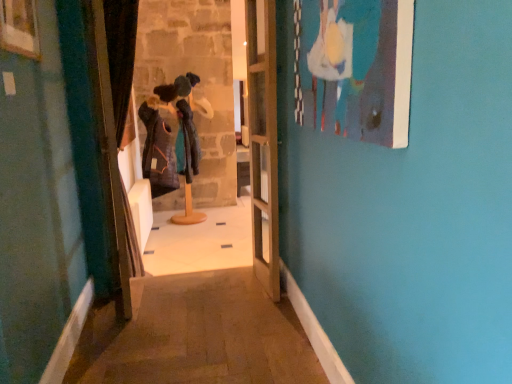
This screenshot has width=512, height=384. What do you see at coordinates (19, 28) in the screenshot?
I see `wooden picture frame at upper left, acting as the 1th picture frame starting from the left` at bounding box center [19, 28].

Identify the location of knitted woolen hat at center. (169, 136).

What is the approximate width of velvet dark brown curtain at left?

It is 3.88 inches.

I want to click on clear glass door at center, so click(263, 141).

From the image's perspective, which picture frame is the 1st one above the clear glass door at center? Please provide its 2D coordinates.

[(354, 68)]

Which point is more forward, (373,120) or (266,254)?

Positioned in front is point (373,120).

From a real-world perspective, who is located lower, matte blue painting at upper right, which appears as the second picture frame when viewed from the left, or clear glass door at center?

From a 3D spatial view, clear glass door at center is below.

Is matte blue painting at upper right, the 1th picture frame viewed from the right, far from clear glass door at center?

matte blue painting at upper right, the 1th picture frame viewed from the right, is far away from clear glass door at center.

In the scene shown: Is velvet dark brown curtain at left aimed at knitted woolen hat at center?

No, velvet dark brown curtain at left is not turned towards knitted woolen hat at center.

Considering the sizes of velvet dark brown curtain at left and knitted woolen hat at center in the image, is velvet dark brown curtain at left wider or thinner than knitted woolen hat at center?

velvet dark brown curtain at left is thinner than knitted woolen hat at center.

Which object is closer to the camera, velvet dark brown curtain at left or knitted woolen hat at center?

velvet dark brown curtain at left.

Which is in front, velvet dark brown curtain at left or clear glass door at center?

velvet dark brown curtain at left is more forward.

From a real-world perspective, is velvet dark brown curtain at left physically located above or below clear glass door at center?

In terms of real-world spatial position, velvet dark brown curtain at left is below clear glass door at center.

Between velvet dark brown curtain at left and clear glass door at center, which one has less height?

velvet dark brown curtain at left is shorter.

Is clear glass door at center surrounded by velvet dark brown curtain at left?

No, velvet dark brown curtain at left does not contain clear glass door at center.

From the image's perspective, between clear glass door at center and velvet dark brown curtain at left, who is located below?

velvet dark brown curtain at left is shown below in the image.

You are a GUI agent. You are given a task and a screenshot of the screen. Output one action in this format:
    pyautogui.click(x=<x>, y=<y>)
    Task: Click on the curtain located below the clear glass door at center (from the image's perspective)
    
    Given the screenshot: What is the action you would take?
    pyautogui.click(x=121, y=56)

Is velvet dark brown curtain at left a part of clear glass door at center?

No, velvet dark brown curtain at left is not surrounded by clear glass door at center.

From a real-world perspective, relative to velvet dark brown curtain at left, is clear glass door at center vertically above or below?

In terms of real-world spatial position, clear glass door at center is above velvet dark brown curtain at left.

Between point (0, 16) and point (116, 73), which one is positioned behind?

Point (116, 73)

This screenshot has width=512, height=384. I want to click on the 1st picture frame in front of the velvet dark brown curtain at left, counting from the anchor's position, so click(x=19, y=28).

Considering the relative sizes of wooden picture frame at upper left, acting as the 1th picture frame starting from the left, and velvet dark brown curtain at left in the image provided, is wooden picture frame at upper left, acting as the 1th picture frame starting from the left, smaller than velvet dark brown curtain at left?

Yes, wooden picture frame at upper left, acting as the 1th picture frame starting from the left, is smaller than velvet dark brown curtain at left.

Where is `curtain in front of the knitted woolen hat at center`? The image size is (512, 384). curtain in front of the knitted woolen hat at center is located at coordinates (121, 56).

Consider the image. Which is correct: knitted woolen hat at center is inside velvet dark brown curtain at left, or outside of it?

knitted woolen hat at center is not enclosed by velvet dark brown curtain at left.

Is knitted woolen hat at center bigger than velvet dark brown curtain at left?

Indeed, knitted woolen hat at center has a larger size compared to velvet dark brown curtain at left.

Is knitted woolen hat at center positioned beyond the bounds of wooden picture frame at upper left, acting as the 1th picture frame starting from the left?

Yes, knitted woolen hat at center is outside of wooden picture frame at upper left, acting as the 1th picture frame starting from the left.

Is point (169, 93) closer or farther from the camera than point (37, 40)?

Point (169, 93).

Where is `couple that appears on the right of wooden picture frame at upper left, which is the 2th picture frame in right-to-left order`? couple that appears on the right of wooden picture frame at upper left, which is the 2th picture frame in right-to-left order is located at coordinates (169, 136).

Is knitted woolen hat at center at the right side of wooden picture frame at upper left, acting as the 1th picture frame starting from the left?

Indeed, knitted woolen hat at center is positioned on the right side of wooden picture frame at upper left, acting as the 1th picture frame starting from the left.

Identify the location of door below the matte blue painting at upper right, the 1th picture frame viewed from the right (from the image's perspective). The width and height of the screenshot is (512, 384). (263, 141).

I want to click on couple that is above the velvet dark brown curtain at left (from the image's perspective), so click(169, 136).

Estimate the real-world distances between objects in this image. Which object is closer to matte blue painting at upper right, the 1th picture frame viewed from the right, velvet dark brown curtain at left or clear glass door at center?

Based on the image, clear glass door at center appears to be nearer to matte blue painting at upper right, the 1th picture frame viewed from the right.

When comparing their distances from velvet dark brown curtain at left, does matte blue painting at upper right, which appears as the second picture frame when viewed from the left, or knitted woolen hat at center seem closer?

matte blue painting at upper right, which appears as the second picture frame when viewed from the left, is closer to velvet dark brown curtain at left.

Based on their spatial positions, is clear glass door at center or matte blue painting at upper right, the 1th picture frame viewed from the right, further from knitted woolen hat at center?

matte blue painting at upper right, the 1th picture frame viewed from the right.

From the image, which object appears to be nearer to velvet dark brown curtain at left, wooden picture frame at upper left, acting as the 1th picture frame starting from the left, or matte blue painting at upper right, which appears as the second picture frame when viewed from the left?

The object closer to velvet dark brown curtain at left is wooden picture frame at upper left, acting as the 1th picture frame starting from the left.

Based on the photo, looking at the image, which one is located further to clear glass door at center, matte blue painting at upper right, which appears as the second picture frame when viewed from the left, or wooden picture frame at upper left, which is the 2th picture frame in right-to-left order?

The object further to clear glass door at center is wooden picture frame at upper left, which is the 2th picture frame in right-to-left order.

Looking at the image, which one is located closer to matte blue painting at upper right, which appears as the second picture frame when viewed from the left, clear glass door at center or wooden picture frame at upper left, which is the 2th picture frame in right-to-left order?

The object closer to matte blue painting at upper right, which appears as the second picture frame when viewed from the left, is clear glass door at center.

Looking at the image, which one is located closer to matte blue painting at upper right, which appears as the second picture frame when viewed from the left, wooden picture frame at upper left, acting as the 1th picture frame starting from the left, or clear glass door at center?

clear glass door at center lies closer to matte blue painting at upper right, which appears as the second picture frame when viewed from the left, than the other object.

Based on their spatial positions, is wooden picture frame at upper left, acting as the 1th picture frame starting from the left, or clear glass door at center further from knitted woolen hat at center?

wooden picture frame at upper left, acting as the 1th picture frame starting from the left, is further to knitted woolen hat at center.

The height and width of the screenshot is (384, 512). I want to click on curtain between wooden picture frame at upper left, which is the 2th picture frame in right-to-left order, and knitted woolen hat at center, along the z-axis, so click(121, 56).

Find the location of a particular element. The image size is (512, 384). curtain positioned between matte blue painting at upper right, the 1th picture frame viewed from the right, and clear glass door at center from near to far is located at coordinates (121, 56).

This screenshot has width=512, height=384. I want to click on door between wooden picture frame at upper left, which is the 2th picture frame in right-to-left order, and matte blue painting at upper right, the 1th picture frame viewed from the right, from left to right, so click(x=263, y=141).

The width and height of the screenshot is (512, 384). Identify the location of door positioned between matte blue painting at upper right, the 1th picture frame viewed from the right, and knitted woolen hat at center from near to far. (263, 141).